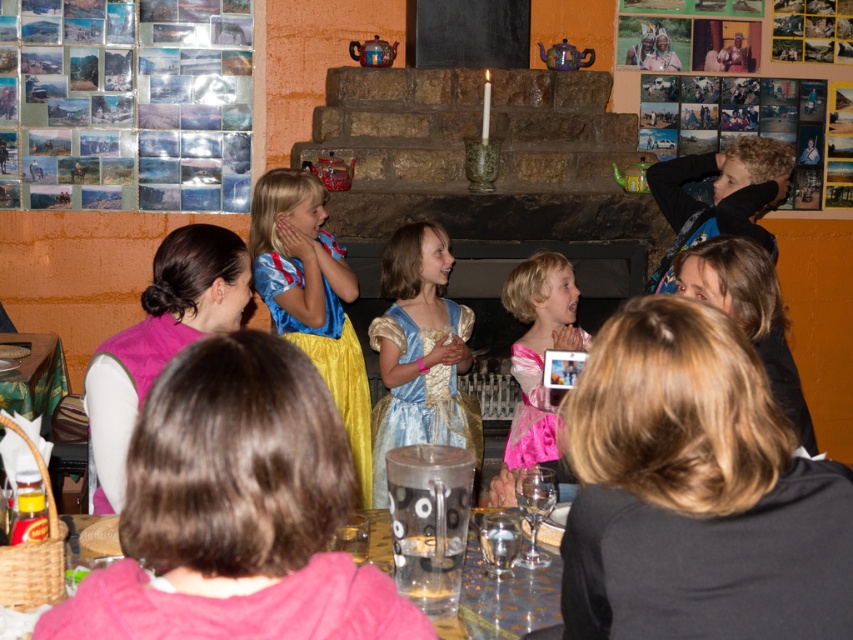
Does pink satin dress at center appear over clear glass table at lower center?

Yes.

Which is above, pink satin dress at center or clear glass table at lower center?

pink satin dress at center

Is point (514, 444) positioned after point (509, 580)?

That is True.

Find the location of a particular element. The image size is (853, 640). pink satin dress at center is located at coordinates (537, 358).

This screenshot has height=640, width=853. Find the location of `black fabric at upper right`. black fabric at upper right is located at coordinates (695, 492).

Is black fabric at upper right behind pink satin dress at center?

No.

Is point (619, 477) less distant than point (548, 337)?

Yes, it is in front of point (548, 337).

Locate an element on the screen. The height and width of the screenshot is (640, 853). black fabric at upper right is located at coordinates (695, 492).

Is black fabric at upper right smaller than clear glass table at lower center?

Incorrect, black fabric at upper right is not smaller in size than clear glass table at lower center.

Can you confirm if black fabric at upper right is positioned below clear glass table at lower center?

No, black fabric at upper right is not below clear glass table at lower center.

Between point (741, 449) and point (494, 582), which one is positioned behind?

Positioned behind is point (494, 582).

Where is `black fabric at upper right`? This screenshot has width=853, height=640. black fabric at upper right is located at coordinates (695, 492).